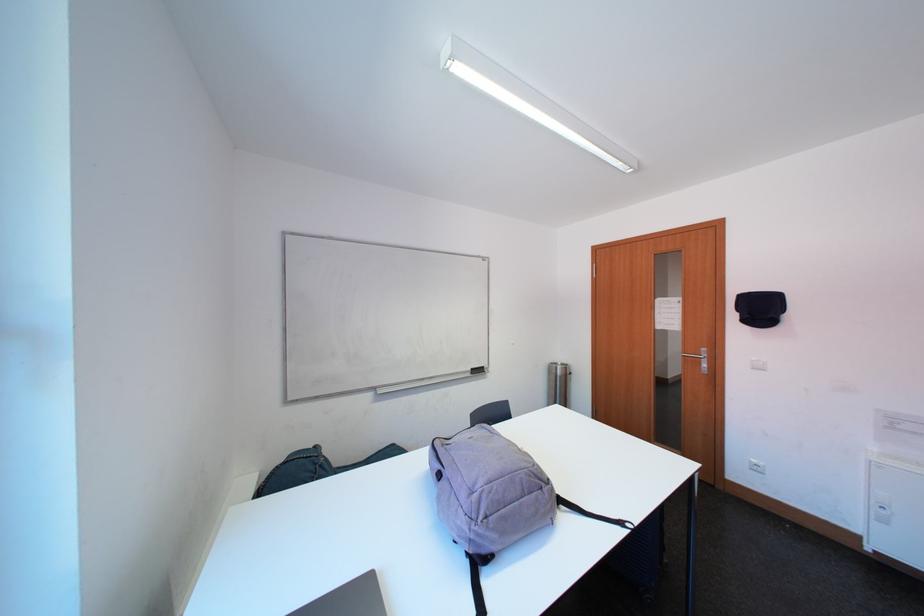
Where would you lift the metal trash can? Please return your answer as a coordinate pair (x, y).

(557, 383)